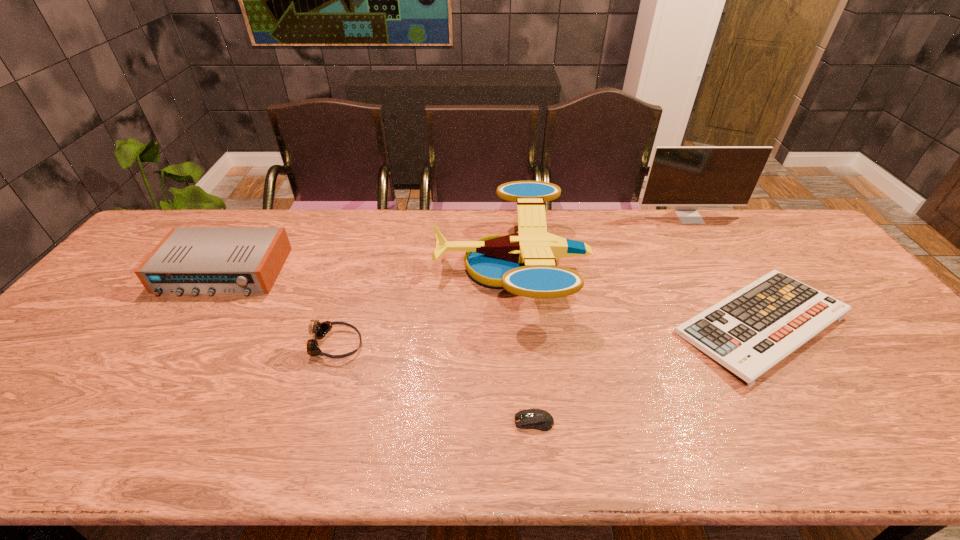
This screenshot has width=960, height=540. Identify the location of vacant region at the far left corner. (188, 218).

Find the location of `vacant space at the far right corner`. vacant space at the far right corner is located at coordinates (761, 230).

Find the location of a particular element. free area in between the second shortest object and the leftmost object is located at coordinates (492, 298).

I want to click on vacant area that lies between the radio receiver and the computer keyboard, so click(x=492, y=298).

Image resolution: width=960 pixels, height=540 pixels. What are the coordinates of `free area in between the second object from left to right and the nearest object` in the screenshot? It's located at (435, 383).

At what (x,y) coordinates should I click in order to perform the action: click on free spot between the nearest object and the third shortest object. Please return your answer as a coordinate pair (x, y). The height and width of the screenshot is (540, 960). Looking at the image, I should click on (435, 383).

At what (x,y) coordinates should I click in order to perform the action: click on free spot between the second object from left to right and the drone. Please return your answer as a coordinate pair (x, y). This screenshot has width=960, height=540. Looking at the image, I should click on (423, 306).

Locate an element on the screen. The height and width of the screenshot is (540, 960). free space between the fifth tallest object and the radio receiver is located at coordinates (492, 298).

Where is `free spot between the second tallest object and the tallest object`? free spot between the second tallest object and the tallest object is located at coordinates (600, 242).

I want to click on object that is the fifth closest to the tallest object, so click(189, 260).